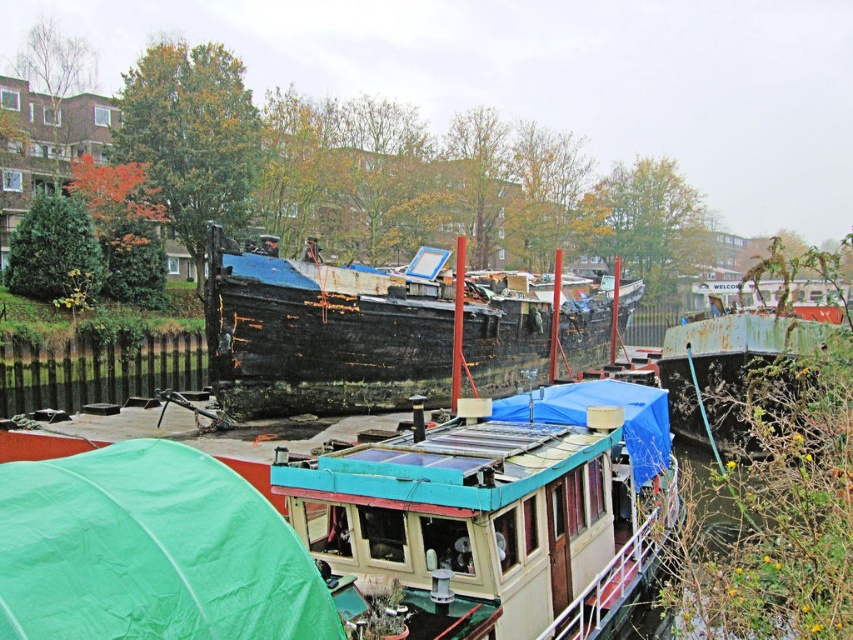
Question: Estimate the real-world distances between objects in this image. Which object is farther from the rusty metal boat at center-right?

Choices:
 (A) teal plastic boat at center
 (B) rusty metal boat at center

Answer: (B)

Question: Is teal plastic boat at center positioned before rusty metal boat at center?

Choices:
 (A) yes
 (B) no

Answer: (A)

Question: Can you confirm if green fabric tent at lower left is positioned to the left of rusty metal boat at center-right?

Choices:
 (A) yes
 (B) no

Answer: (A)

Question: Does green fabric tent at lower left appear on the right side of rusty metal boat at center-right?

Choices:
 (A) no
 (B) yes

Answer: (A)

Question: Based on their relative distances, which object is nearer to the rusty metal boat at center-right?

Choices:
 (A) green fabric tent at lower left
 (B) teal plastic boat at center

Answer: (B)

Question: Which point is farther to the camera?

Choices:
 (A) (410, 560)
 (B) (112, 568)

Answer: (A)